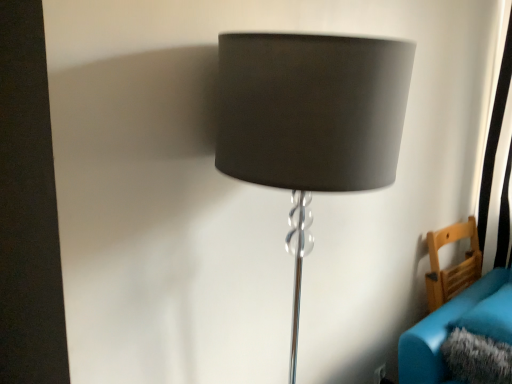
Question: From a real-world perspective, is velvet teal couch at lower right positioned over wooden chair at lower right based on gravity?

Choices:
 (A) no
 (B) yes

Answer: (A)

Question: Does velvet teal couch at lower right have a greater height compared to wooden chair at lower right?

Choices:
 (A) yes
 (B) no

Answer: (B)

Question: Would you say velvet teal couch at lower right is outside wooden chair at lower right?

Choices:
 (A) yes
 (B) no

Answer: (A)

Question: Can you confirm if velvet teal couch at lower right is shorter than wooden chair at lower right?

Choices:
 (A) no
 (B) yes

Answer: (B)

Question: From a real-world perspective, is velvet teal couch at lower right located beneath wooden chair at lower right?

Choices:
 (A) no
 (B) yes

Answer: (B)

Question: From their relative heights in the image, would you say matte gray lampshade at center is taller or shorter than wooden chair at lower right?

Choices:
 (A) tall
 (B) short

Answer: (A)

Question: Looking at the image, does matte gray lampshade at center seem bigger or smaller compared to wooden chair at lower right?

Choices:
 (A) small
 (B) big

Answer: (B)

Question: Is point (254, 57) closer or farther from the camera than point (476, 235)?

Choices:
 (A) farther
 (B) closer

Answer: (B)

Question: From the image's perspective, is matte gray lampshade at center located above or below wooden chair at lower right?

Choices:
 (A) below
 (B) above

Answer: (B)

Question: Considering the positions of wooden chair at lower right and velvet teal couch at lower right in the image, is wooden chair at lower right taller or shorter than velvet teal couch at lower right?

Choices:
 (A) tall
 (B) short

Answer: (A)

Question: Is wooden chair at lower right situated inside velvet teal couch at lower right or outside?

Choices:
 (A) inside
 (B) outside

Answer: (B)

Question: From the image's perspective, is wooden chair at lower right located above or below velvet teal couch at lower right?

Choices:
 (A) below
 (B) above

Answer: (B)

Question: From a real-world perspective, is wooden chair at lower right physically located above or below velvet teal couch at lower right?

Choices:
 (A) above
 (B) below

Answer: (A)

Question: Choose the correct answer: Is velvet teal couch at lower right inside wooden chair at lower right or outside it?

Choices:
 (A) outside
 (B) inside

Answer: (A)

Question: Looking at their shapes, would you say velvet teal couch at lower right is wider or thinner than wooden chair at lower right?

Choices:
 (A) thin
 (B) wide

Answer: (B)